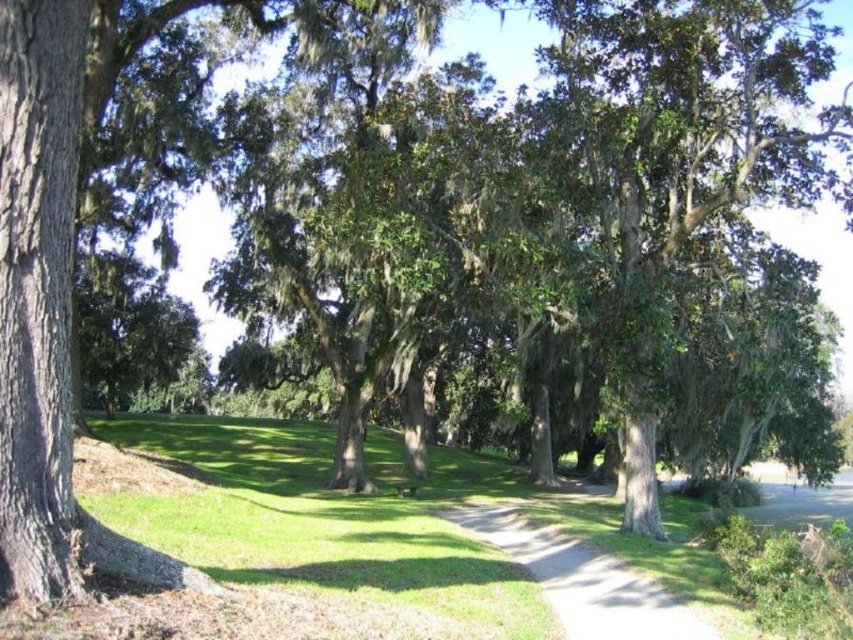
You are a gardener who needs to place a new flower bed between the smooth concrete path at center and the wooden park bench at center. Which object should you place the flower bed closer to if you want it to be more noticeable to visitors walking along the path?

The smooth concrete path at center is larger in size than the wooden park bench at center, so placing the flower bed closer to the smooth concrete path at center would make it more noticeable to visitors walking along the path.

A child is standing on the smooth concrete path at center and wants to throw a ball to their sibling who is standing 7.94 meters away. If the sibling is somewhere in the park, where could they be standing?

The sibling could be standing near the large, mature trees with thick trunks and sprawling canopies in the midground and background, as they are 7.94 meters away from the smooth concrete path at center.